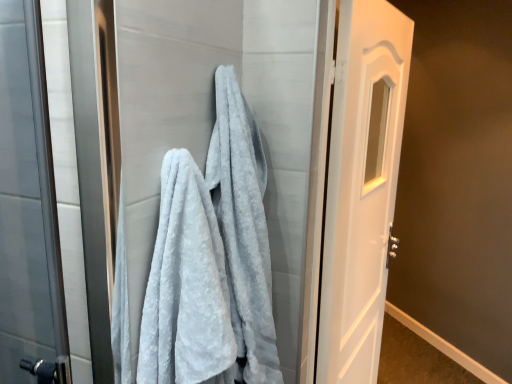
Question: Looking at their shapes, would you say white glossy door at right is wider or thinner than gray fluffy towel at center?

Choices:
 (A) thin
 (B) wide

Answer: (A)

Question: From the image's perspective, is white glossy door at right positioned above or below gray fluffy towel at center?

Choices:
 (A) above
 (B) below

Answer: (B)

Question: Which object is positioned farthest from the white glossy door at right?

Choices:
 (A) gray fluffy towel at center
 (B) light gray fluffy towel at center

Answer: (B)

Question: Estimate the real-world distances between objects in this image. Which object is closer to the light gray fluffy towel at center?

Choices:
 (A) gray fluffy towel at center
 (B) white glossy door at right

Answer: (A)